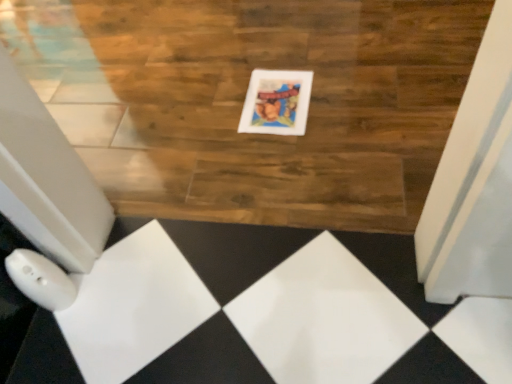
Where is `free space above white glossy picture frame at center (from a real-world perspective)`? free space above white glossy picture frame at center (from a real-world perspective) is located at coordinates (276, 94).